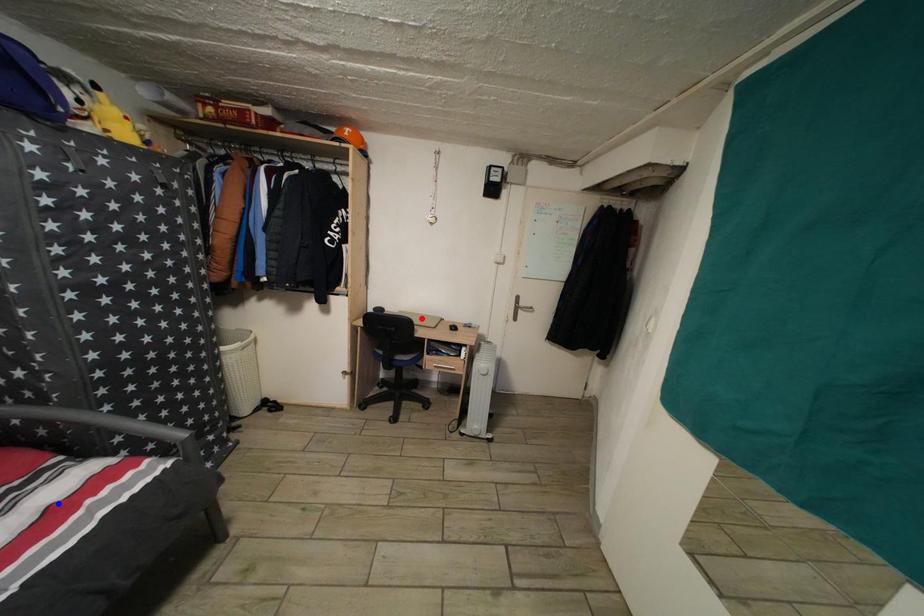
Question: In the image, two points are highlighted. Which point is nearer to the camera? Reply with the corresponding letter.

Choices:
 (A) blue point
 (B) red point

Answer: (A)